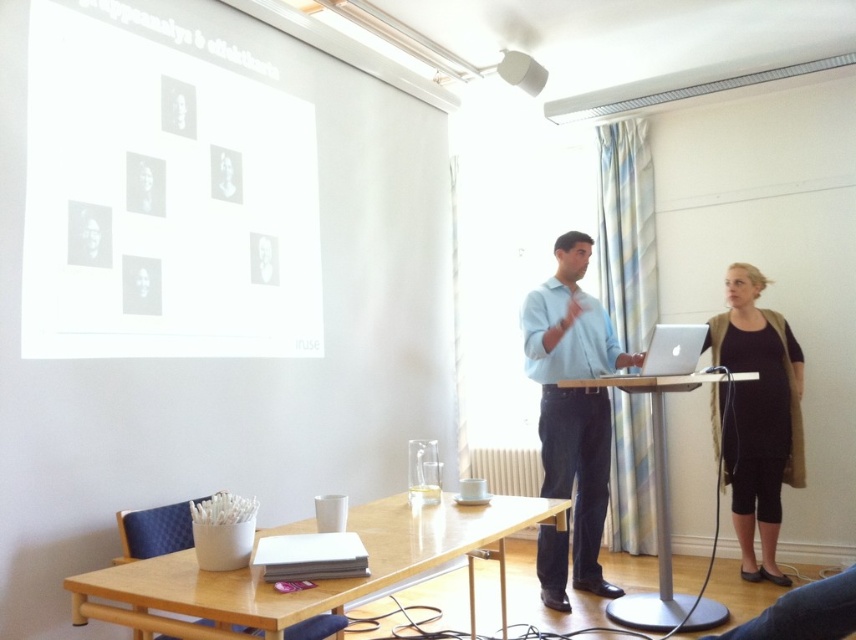
How distant is matte black portrait at upper left from matte white cylindrical at upper center?

matte black portrait at upper left is 2.21 meters from matte white cylindrical at upper center.

Is matte black portrait at upper left bigger than matte white cylindrical at upper center?

No.

Is point (87, 214) positioned behind point (530, 81)?

That is False.

Locate an element on the screen. The image size is (856, 640). matte black portrait at upper left is located at coordinates (88, 234).

Does point (162, 195) lie behind point (211, 173)?

No, it is in front of (211, 173).

The image size is (856, 640). What do you see at coordinates (144, 184) in the screenshot? I see `smooth skin portrait at upper left` at bounding box center [144, 184].

The image size is (856, 640). In order to click on smooth skin portrait at upper left in this screenshot , I will do `click(144, 184)`.

Does light blue shirt at center have a lesser height compared to smooth skin portrait at upper left?

No.

Who is positioned more to the left, light blue shirt at center or smooth skin portrait at upper left?

smooth skin portrait at upper left

The width and height of the screenshot is (856, 640). What are the coordinates of `light blue shirt at center` in the screenshot? It's located at (574, 400).